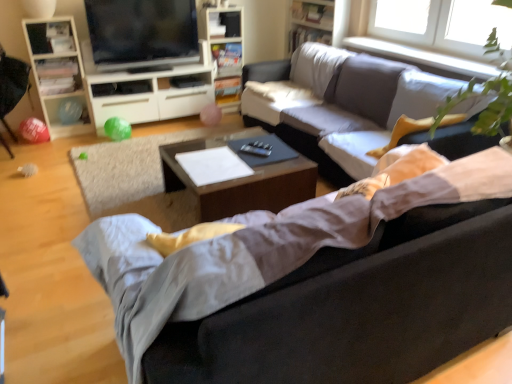
Where is `vacant space in matte black tv at upper left (from a real-world perspective)`? This screenshot has width=512, height=384. vacant space in matte black tv at upper left (from a real-world perspective) is located at coordinates (152, 70).